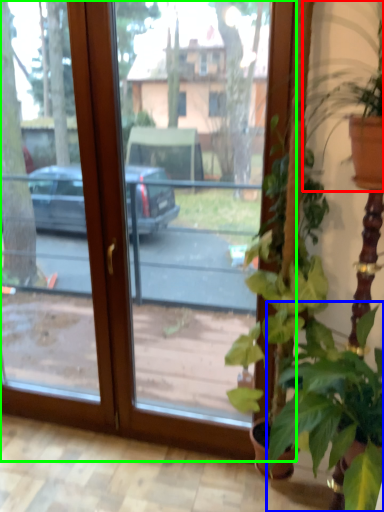
Question: Which object is positioned farthest from houseplant (highlighted by a red box)? Select from houseplant (highlighted by a blue box) and window (highlighted by a green box).

Choices:
 (A) houseplant
 (B) window

Answer: (B)